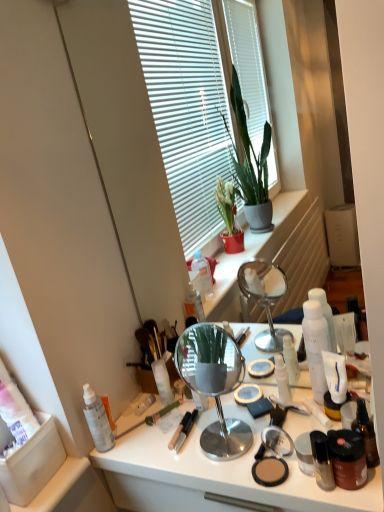
Question: From a real-world perspective, is white matte lotion at right, acting as the third toiletry starting from the right, located higher than matte brown compact at lower center?

Choices:
 (A) yes
 (B) no

Answer: (A)

Question: Is the position of white matte lotion at right, acting as the third toiletry starting from the right, more distant than that of matte brown compact at lower center?

Choices:
 (A) no
 (B) yes

Answer: (B)

Question: Considering the relative sizes of white matte lotion at right, the fifth toiletry positioned from the left, and matte brown compact at lower center in the image provided, is white matte lotion at right, the fifth toiletry positioned from the left, wider than matte brown compact at lower center?

Choices:
 (A) no
 (B) yes

Answer: (A)

Question: Does white matte lotion at right, the fifth toiletry positioned from the left, appear on the left side of matte brown compact at lower center?

Choices:
 (A) no
 (B) yes

Answer: (A)

Question: Is white matte lotion at right, the fifth toiletry positioned from the left, at the right side of matte brown compact at lower center?

Choices:
 (A) yes
 (B) no

Answer: (A)

Question: Is white matte lotion at right, the fifth toiletry positioned from the left, positioned with its back to matte brown compact at lower center?

Choices:
 (A) yes
 (B) no

Answer: (B)

Question: From the image's perspective, is transparent plastic spray bottle at left, the 7th toiletry in the right-to-left sequence, on white matte lotion at right, acting as the third toiletry starting from the right?

Choices:
 (A) yes
 (B) no

Answer: (B)

Question: Considering the relative sizes of transparent plastic spray bottle at left, the 7th toiletry in the right-to-left sequence, and white matte lotion at right, acting as the third toiletry starting from the right, in the image provided, is transparent plastic spray bottle at left, the 7th toiletry in the right-to-left sequence, thinner than white matte lotion at right, acting as the third toiletry starting from the right,?

Choices:
 (A) yes
 (B) no

Answer: (B)

Question: From a real-world perspective, is transparent plastic spray bottle at left, the 7th toiletry in the right-to-left sequence, physically above white matte lotion at right, acting as the third toiletry starting from the right?

Choices:
 (A) no
 (B) yes

Answer: (A)

Question: Is transparent plastic spray bottle at left, the 7th toiletry in the right-to-left sequence, smaller than white matte lotion at right, acting as the third toiletry starting from the right?

Choices:
 (A) yes
 (B) no

Answer: (A)

Question: Could white matte lotion at right, the fifth toiletry positioned from the left, be considered to be inside transparent plastic spray bottle at left, the 7th toiletry in the right-to-left sequence?

Choices:
 (A) yes
 (B) no

Answer: (B)

Question: Does transparent plastic spray bottle at left, the 1th toiletry in the left-to-right sequence, come in front of white matte lotion at right, acting as the third toiletry starting from the right?

Choices:
 (A) no
 (B) yes

Answer: (A)

Question: Is shiny black bottle at lower right, the 4th toiletry viewed from the right, closer to camera compared to white glossy lotion at center, placed as the third toiletry when sorted from left to right?

Choices:
 (A) no
 (B) yes

Answer: (B)